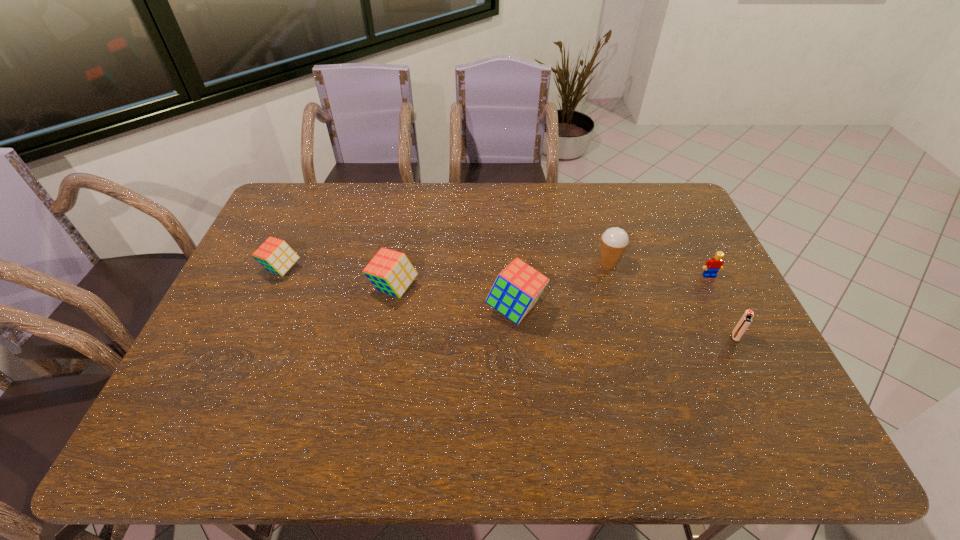
Find the location of a particular element. the shortest cube is located at coordinates (274, 254).

This screenshot has height=540, width=960. Find the location of `the leftmost object`. the leftmost object is located at coordinates (274, 254).

Locate an element on the screen. The width and height of the screenshot is (960, 540). the fifth object from right to left is located at coordinates (391, 272).

Identify the location of the second cube from left to right. (391, 272).

Find the location of `the rightmost cube`. the rightmost cube is located at coordinates (517, 288).

Locate an element on the screen. Lego is located at coordinates (712, 266).

Where is `igniter`? The image size is (960, 540). igniter is located at coordinates (745, 321).

The width and height of the screenshot is (960, 540). Identify the location of icecream. (614, 241).

Find the location of a particular element. vacant space located on the back of the leftmost cube is located at coordinates (304, 219).

Identify the location of free spot located on the right of the second shortest cube. (464, 288).